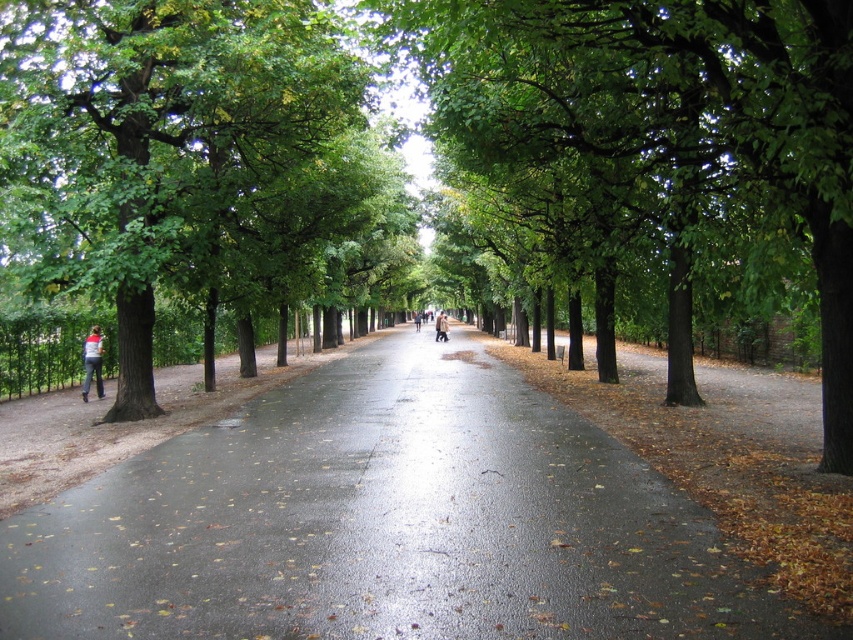
Question: Which object appears closest to the camera in this image?

Choices:
 (A) white and red jacket at left
 (B) green leafy tree at left
 (C) shiny asphalt road at center

Answer: (C)

Question: Which of the following is the farthest from the observer?

Choices:
 (A) (413, 314)
 (B) (808, 28)

Answer: (A)

Question: Is green leafy tree at center bigger than dark blue jeans at center?

Choices:
 (A) no
 (B) yes

Answer: (B)

Question: Based on their relative distances, which object is farther from the green leafy tree at center?

Choices:
 (A) green leafy tree at left
 (B) light brown leather coat at center
 (C) shiny asphalt road at center
 (D) white and red jacket at left

Answer: (B)

Question: Is green leafy tree at left to the left of white and red jacket at left from the viewer's perspective?

Choices:
 (A) no
 (B) yes

Answer: (A)

Question: Can you confirm if shiny asphalt road at center is smaller than dark blue jeans at center?

Choices:
 (A) no
 (B) yes

Answer: (B)